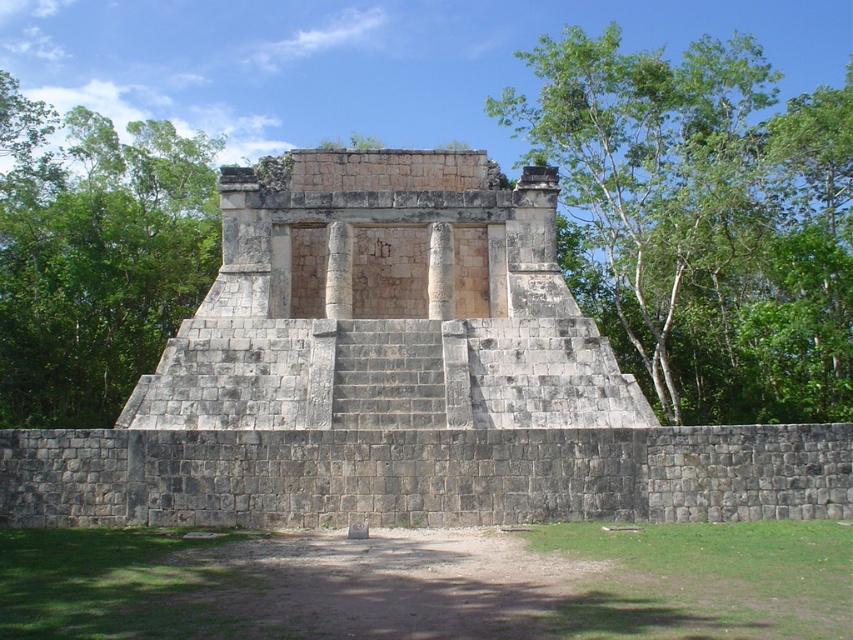
Question: Which object is the closest to the green leafy tree at upper right?

Choices:
 (A) stone/rough pyramid at center
 (B) green leafy tree at upper left

Answer: (A)

Question: Considering the real-world distances, which object is farthest from the green leafy tree at upper right?

Choices:
 (A) green leafy tree at upper left
 (B) stone/rough pyramid at center

Answer: (A)

Question: Which of the following is the farthest from the observer?

Choices:
 (A) stone/rough pyramid at center
 (B) green leafy tree at upper right
 (C) green leafy tree at upper left

Answer: (C)

Question: In this image, where is green leafy tree at upper right located relative to green leafy tree at upper left?

Choices:
 (A) above
 (B) below

Answer: (A)

Question: Can you confirm if stone/rough pyramid at center is smaller than green leafy tree at upper right?

Choices:
 (A) no
 (B) yes

Answer: (B)

Question: Does stone/rough pyramid at center come in front of green leafy tree at upper right?

Choices:
 (A) yes
 (B) no

Answer: (A)